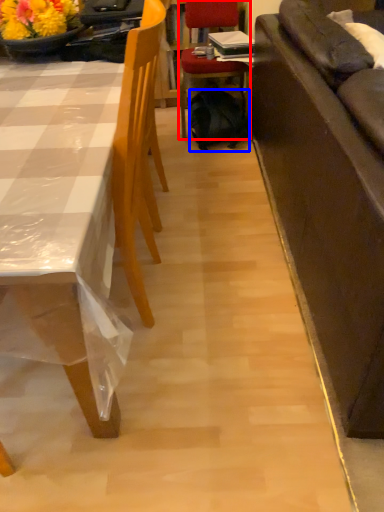
Question: Which object is further to the camera taking this photo, chair (highlighted by a red box) or backpack (highlighted by a blue box)?

Choices:
 (A) chair
 (B) backpack

Answer: (B)